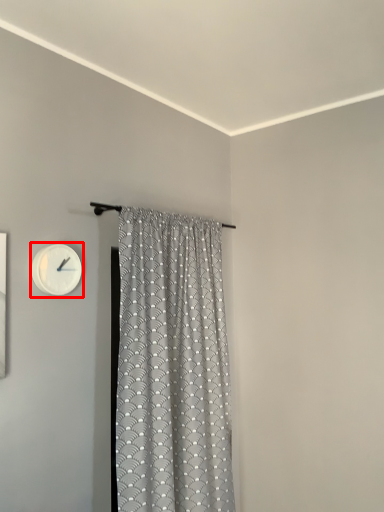
Question: From the image's perspective, what is the correct spatial positioning of wall clock (annotated by the red box) in reference to curtain?

Choices:
 (A) above
 (B) below

Answer: (A)